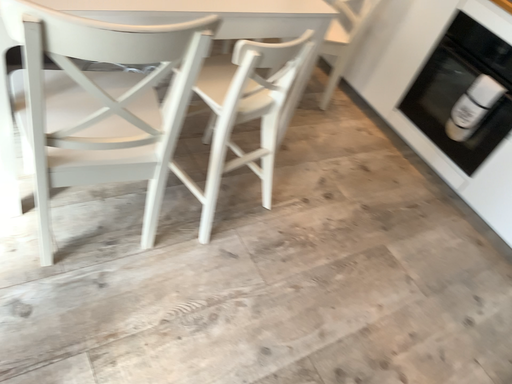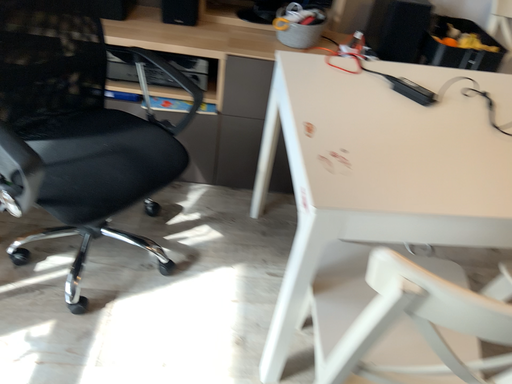
Question: Which way did the camera rotate in the video?

Choices:
 (A) rotated right
 (B) rotated left

Answer: (B)